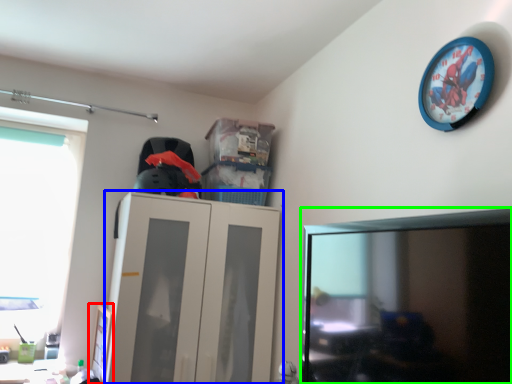
Question: Which object is the farthest from picture frame (highlighted by a red box)? Choose among these: cabinetry (highlighted by a blue box) or computer monitor (highlighted by a green box).

Choices:
 (A) cabinetry
 (B) computer monitor

Answer: (B)